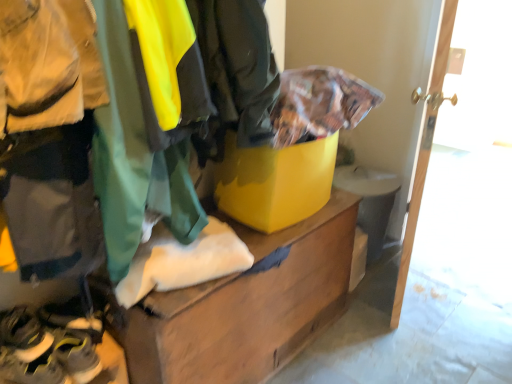
Where is `free spot in front of wooden door at right`? Image resolution: width=512 pixels, height=384 pixels. free spot in front of wooden door at right is located at coordinates (x=421, y=340).